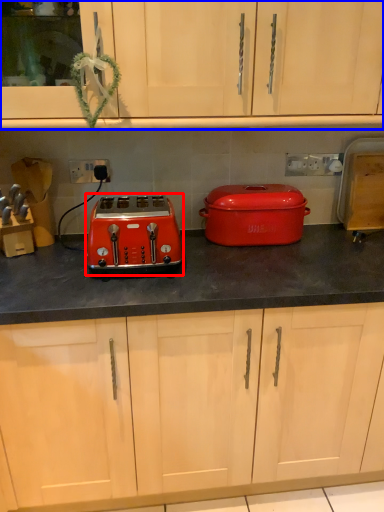
Question: Which of the following is the closest to the observer, toaster (highlighted by a red box) or cabinetry (highlighted by a blue box)?

Choices:
 (A) toaster
 (B) cabinetry

Answer: (B)